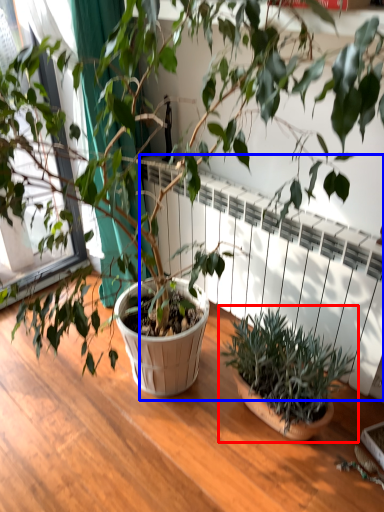
Question: Which point is further to the camera, houseplant (highlighted by a red box) or radiator (highlighted by a blue box)?

Choices:
 (A) houseplant
 (B) radiator

Answer: (B)